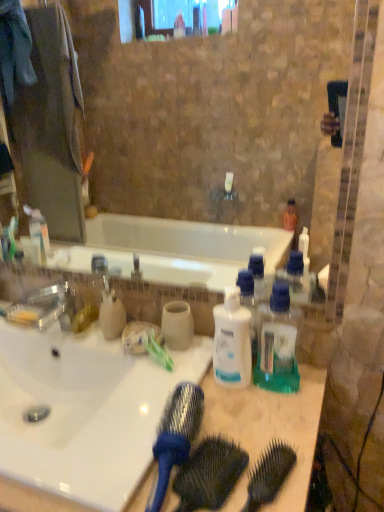
This screenshot has width=384, height=512. Describe the element at coordinates (277, 344) in the screenshot. I see `translucent green plastic at center, the 1th bottle positioned from the right` at that location.

Locate an element on the screen. The height and width of the screenshot is (512, 384). translucent green plastic at center, which appears as the 2th bottle when viewed from the left is located at coordinates [x=277, y=344].

What are the coordinates of `white plastic bottle at center, the 2th bottle from the right` in the screenshot? It's located at (232, 341).

The image size is (384, 512). What do you see at coordinates (157, 350) in the screenshot?
I see `green plastic toothbrush at center` at bounding box center [157, 350].

What is the approximate width of blue plastic comb at center?

blue plastic comb at center is 9.78 inches in width.

I want to click on translucent green plastic at center, which appears as the 2th bottle when viewed from the left, so click(277, 344).

Considering the positions of objects translucent green plastic at center, which appears as the 2th bottle when viewed from the left, and white glossy sink at center in the image provided, who is behind, translucent green plastic at center, which appears as the 2th bottle when viewed from the left, or white glossy sink at center?

translucent green plastic at center, which appears as the 2th bottle when viewed from the left, is further from the camera.

From a real-world perspective, is translucent green plastic at center, which appears as the 2th bottle when viewed from the left, physically below white glossy sink at center?

No, from a real-world perspective, translucent green plastic at center, which appears as the 2th bottle when viewed from the left, is not below white glossy sink at center.

Is blue plastic comb at center wider or thinner than translucent green plastic at center, the 1th bottle positioned from the right?

Clearly, blue plastic comb at center has more width compared to translucent green plastic at center, the 1th bottle positioned from the right.

From a real-world perspective, which is physically below, blue plastic comb at center or translucent green plastic at center, which appears as the 2th bottle when viewed from the left?

blue plastic comb at center, from a real-world perspective.

Is the depth of blue plastic comb at center greater than that of translucent green plastic at center, which appears as the 2th bottle when viewed from the left?

No.

Is the surface of blue plastic comb at center in direct contact with translucent green plastic at center, which appears as the 2th bottle when viewed from the left?

blue plastic comb at center is not next to translucent green plastic at center, which appears as the 2th bottle when viewed from the left, and they're not touching.

Is black plastic brush at center, marked as the second brush in a left-to-right arrangement, to the left of translucent green plastic at center, the 1th bottle positioned from the right, from the viewer's perspective?

Yes.

From a real-world perspective, is black plastic brush at center, marked as the second brush in a left-to-right arrangement, positioned under translucent green plastic at center, the 1th bottle positioned from the right, based on gravity?

Yes, from a real-world perspective, black plastic brush at center, marked as the second brush in a left-to-right arrangement, is beneath translucent green plastic at center, the 1th bottle positioned from the right.

Considering the sizes of objects black plastic brush at center, acting as the 1th brush starting from the right, and translucent green plastic at center, which appears as the 2th bottle when viewed from the left, in the image provided, who is bigger, black plastic brush at center, acting as the 1th brush starting from the right, or translucent green plastic at center, which appears as the 2th bottle when viewed from the left,?

With larger size is translucent green plastic at center, which appears as the 2th bottle when viewed from the left.

Which is in front, black plastic brush at center, marked as the second brush in a left-to-right arrangement, or translucent green plastic at center, the 1th bottle positioned from the right?

black plastic brush at center, marked as the second brush in a left-to-right arrangement, is closer to the camera.

Is black plastic brush at center, acting as the 1th brush starting from the right, inside the boundaries of blue plastic brush at center, which is the 2th brush in right-to-left order, or outside?

black plastic brush at center, acting as the 1th brush starting from the right, is not inside blue plastic brush at center, which is the 2th brush in right-to-left order, it's outside.

Is black plastic brush at center, marked as the second brush in a left-to-right arrangement, wider or thinner than blue plastic brush at center, which is the 2th brush in right-to-left order?

In the image, black plastic brush at center, marked as the second brush in a left-to-right arrangement, appears to be more narrow than blue plastic brush at center, which is the 2th brush in right-to-left order.

Based on the photo, in the image, is black plastic brush at center, acting as the 1th brush starting from the right, on the left side or the right side of blue plastic brush at center, which appears as the 1th brush when viewed from the left?

black plastic brush at center, acting as the 1th brush starting from the right, is positioned on blue plastic brush at center, which appears as the 1th brush when viewed from the left,'s right side.

In the scene shown: Considering the sizes of objects black plastic brush at center, marked as the second brush in a left-to-right arrangement, and blue plastic brush at center, which appears as the 1th brush when viewed from the left, in the image provided, who is taller, black plastic brush at center, marked as the second brush in a left-to-right arrangement, or blue plastic brush at center, which appears as the 1th brush when viewed from the left,?

blue plastic brush at center, which appears as the 1th brush when viewed from the left, is taller.

Which object is wider, black plastic brush at center, acting as the 1th brush starting from the right, or blue plastic comb at center?

With larger width is blue plastic comb at center.

Can you confirm if black plastic brush at center, marked as the second brush in a left-to-right arrangement, is shorter than blue plastic comb at center?

Indeed, black plastic brush at center, marked as the second brush in a left-to-right arrangement, has a lesser height compared to blue plastic comb at center.

Is the position of black plastic brush at center, acting as the 1th brush starting from the right, less distant than that of blue plastic comb at center?

No, it is not.

Is black plastic brush at center, marked as the second brush in a left-to-right arrangement, touching blue plastic comb at center?

Yes.

Considering the sizes of black plastic brush at center, acting as the 1th brush starting from the right, and matte beige soap dispenser at center-left in the image, is black plastic brush at center, acting as the 1th brush starting from the right, taller or shorter than matte beige soap dispenser at center-left?

Clearly, black plastic brush at center, acting as the 1th brush starting from the right, is shorter compared to matte beige soap dispenser at center-left.

Considering the relative sizes of black plastic brush at center, acting as the 1th brush starting from the right, and matte beige soap dispenser at center-left in the image provided, is black plastic brush at center, acting as the 1th brush starting from the right, smaller than matte beige soap dispenser at center-left?

Yes.

Considering the positions of objects black plastic brush at center, marked as the second brush in a left-to-right arrangement, and matte beige soap dispenser at center-left in the image provided, who is more to the right, black plastic brush at center, marked as the second brush in a left-to-right arrangement, or matte beige soap dispenser at center-left?

Positioned to the right is black plastic brush at center, marked as the second brush in a left-to-right arrangement.

Is translucent green plastic at center, the 1th bottle positioned from the right, thinner than matte beige soap dispenser at center-left?

Yes, translucent green plastic at center, the 1th bottle positioned from the right, is thinner than matte beige soap dispenser at center-left.

From the image's perspective, who appears lower, translucent green plastic at center, which appears as the 2th bottle when viewed from the left, or matte beige soap dispenser at center-left?

From the image's view, translucent green plastic at center, which appears as the 2th bottle when viewed from the left, is below.

Considering the relative sizes of translucent green plastic at center, which appears as the 2th bottle when viewed from the left, and matte beige soap dispenser at center-left in the image provided, is translucent green plastic at center, which appears as the 2th bottle when viewed from the left, smaller than matte beige soap dispenser at center-left?

No.

You are a GUI agent. You are given a task and a screenshot of the screen. Output one action in this format:
    pyautogui.click(x=<x>, y=<y>)
    Task: Click on the sink that appears on the left of translucent green plastic at center, the 1th bottle positioned from the right
    
    Given the screenshot: What is the action you would take?
    pyautogui.click(x=84, y=410)

From the blue plastic comb at center, count 1st bottles backward and point to it. Please provide its 2D coordinates.

[(277, 344)]

From the image, which object appears to be farther from translucent green plastic at center, which appears as the 2th bottle when viewed from the left, white glossy sink at center or green plastic toothbrush at center?

Among the two, white glossy sink at center is located further to translucent green plastic at center, which appears as the 2th bottle when viewed from the left.

When comparing their distances from blue plastic brush at center, which appears as the 1th brush when viewed from the left, does blue plastic comb at center or translucent green plastic at center, which appears as the 2th bottle when viewed from the left, seem closer?

blue plastic comb at center lies closer to blue plastic brush at center, which appears as the 1th brush when viewed from the left, than the other object.

Considering their positions, is matte beige soap dispenser at center-left positioned further to white glossy sink at center than blue plastic brush at center, which appears as the 1th brush when viewed from the left?

A: Based on the image, blue plastic brush at center, which appears as the 1th brush when viewed from the left, appears to be further to white glossy sink at center.

Estimate the real-world distances between objects in this image. Which object is closer to blue plastic brush at center, which is the 2th brush in right-to-left order, matte beige soap dispenser at center-left or white plastic bottle at center, the 2th bottle from the right?

white plastic bottle at center, the 2th bottle from the right, is closer to blue plastic brush at center, which is the 2th brush in right-to-left order.

Considering their positions, is white glossy sink at center positioned closer to black plastic brush at center, marked as the second brush in a left-to-right arrangement, than translucent green plastic at center, which appears as the 2th bottle when viewed from the left?

translucent green plastic at center, which appears as the 2th bottle when viewed from the left, lies closer to black plastic brush at center, marked as the second brush in a left-to-right arrangement, than the other object.

From the image, which object appears to be nearer to black plastic brush at center, marked as the second brush in a left-to-right arrangement, white plastic bottle at center, the 2th bottle from the right, or blue plastic brush at center, which is the 2th brush in right-to-left order?

blue plastic brush at center, which is the 2th brush in right-to-left order, lies closer to black plastic brush at center, marked as the second brush in a left-to-right arrangement, than the other object.

When comparing their distances from translucent green plastic at center, which appears as the 2th bottle when viewed from the left, does blue plastic comb at center or matte beige soap dispenser at center-left seem further?

matte beige soap dispenser at center-left.

From the image, which object appears to be nearer to blue plastic brush at center, which appears as the 1th brush when viewed from the left, white glossy sink at center or white plastic bottle at center, which is the 1th bottle in left-to-right order?

white plastic bottle at center, which is the 1th bottle in left-to-right order, is closer to blue plastic brush at center, which appears as the 1th brush when viewed from the left.

Image resolution: width=384 pixels, height=512 pixels. I want to click on bottle between matte beige soap dispenser at center-left and translucent green plastic at center, the 1th bottle positioned from the right, so click(232, 341).

Identify the location of brush situated between white glossy sink at center and black plastic brush at center, marked as the second brush in a left-to-right arrangement, from left to right. (175, 436).

Locate an element on the screen. Image resolution: width=384 pixels, height=512 pixels. toothbrush located between matte beige soap dispenser at center-left and white plastic bottle at center, which is the 1th bottle in left-to-right order, in the left-right direction is located at coordinates click(157, 350).

Locate an element on the screen. The height and width of the screenshot is (512, 384). toothbrush positioned between blue plastic comb at center and matte beige soap dispenser at center-left from near to far is located at coordinates (157, 350).